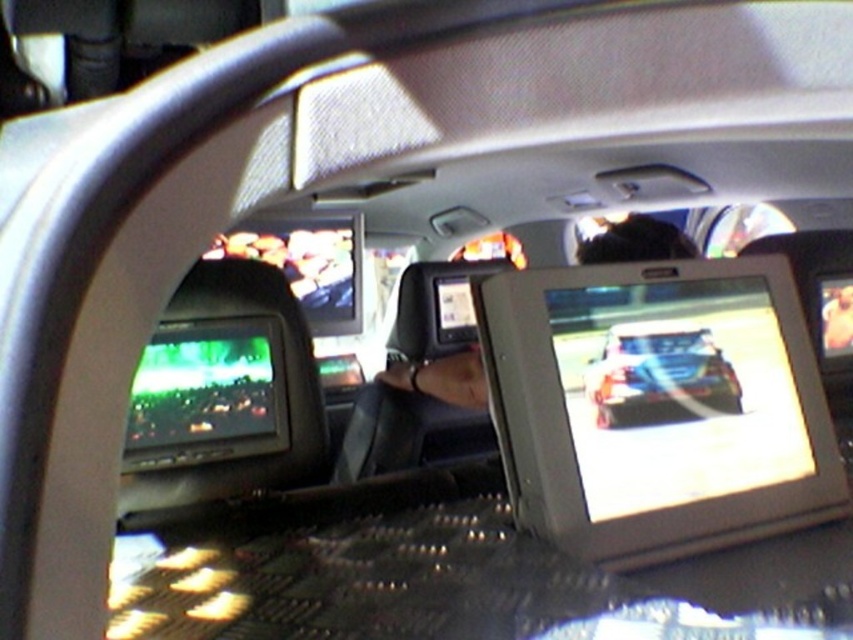
Question: Which point appears closest to the camera in this image?

Choices:
 (A) (672, 385)
 (B) (798, 436)

Answer: (A)

Question: Is shiny plastic screen at center bigger than shiny metallic car at center?

Choices:
 (A) no
 (B) yes

Answer: (B)

Question: Which of the following is the farthest from the observer?

Choices:
 (A) shiny metallic car at center
 (B) matte black monitor at center
 (C) shiny plastic screen at center

Answer: (B)

Question: Which object is farther from the camera taking this photo?

Choices:
 (A) shiny plastic screen at center
 (B) shiny metallic car at center
 (C) matte black monitor at center

Answer: (C)

Question: Is shiny plastic screen at center smaller than shiny metallic car at center?

Choices:
 (A) yes
 (B) no

Answer: (B)

Question: Can you confirm if shiny plastic screen at center is positioned to the right of shiny metallic car at center?

Choices:
 (A) no
 (B) yes

Answer: (B)